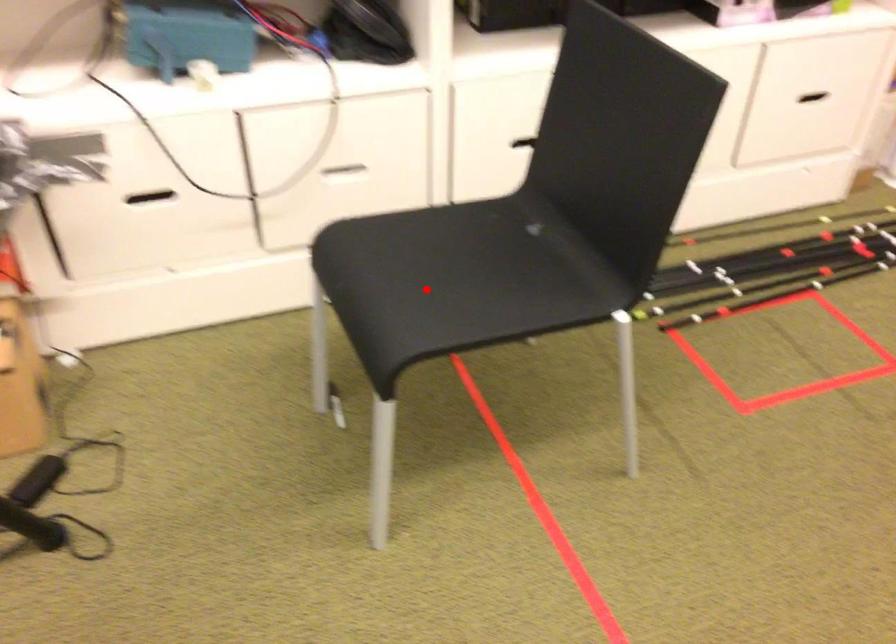
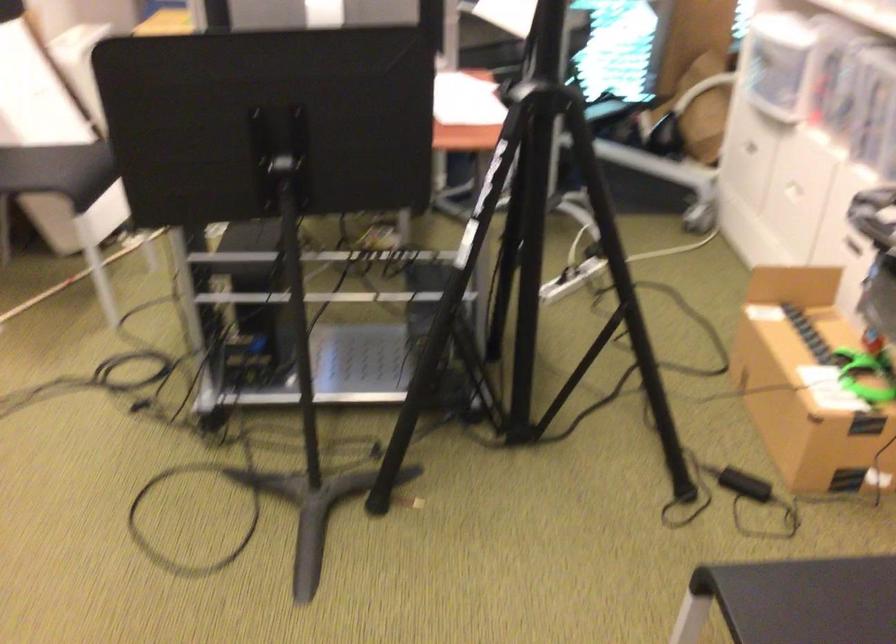
Where in the second image is the point corresponding to the highlighted location from the first image?

(842, 597)